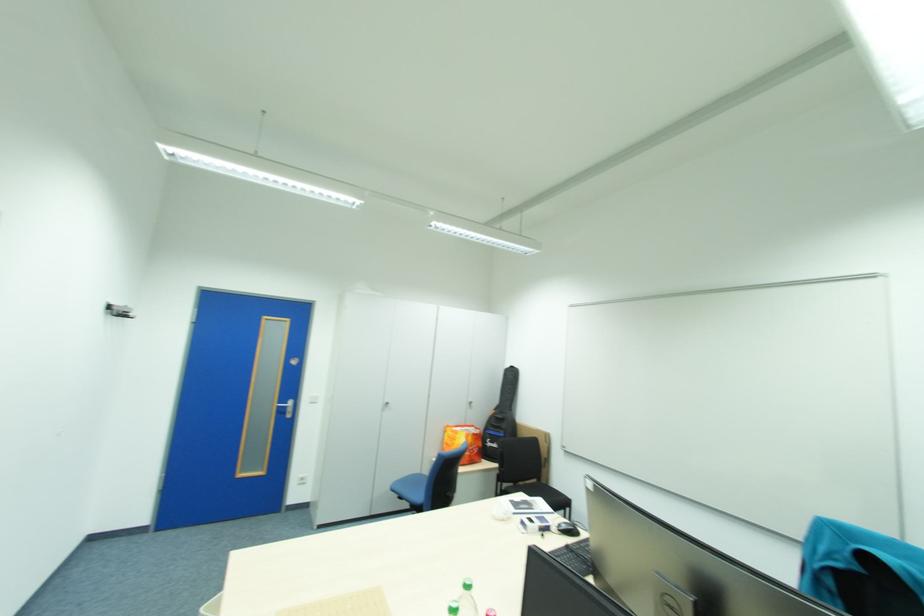
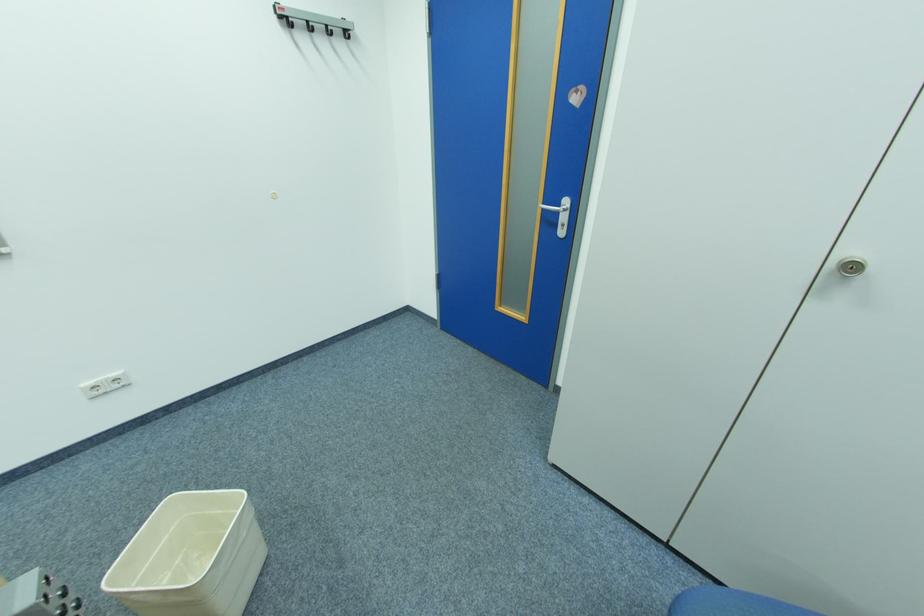
Locate, in the second image, the point that corresponds to point 286,407 in the first image.

(552, 209)